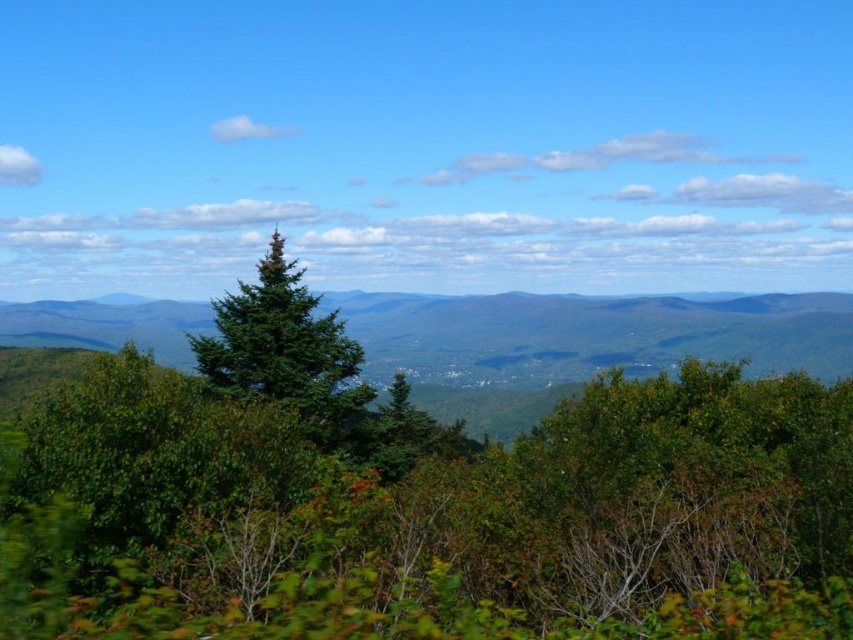
Question: Does green leafy tree at center have a greater width compared to green leafy trees at center?

Choices:
 (A) no
 (B) yes

Answer: (A)

Question: Which point is closer to the camera taking this photo?

Choices:
 (A) (744, 308)
 (B) (283, 280)

Answer: (B)

Question: Does green leafy trees at center appear on the right side of green matte tree at center?

Choices:
 (A) yes
 (B) no

Answer: (B)

Question: Based on their relative distances, which object is farther from the green leafy trees at center?

Choices:
 (A) green leafy tree at center
 (B) green matte tree at center

Answer: (B)

Question: Is green leafy tree at center positioned at the back of green matte tree at center?

Choices:
 (A) no
 (B) yes

Answer: (A)

Question: Which point is closer to the camera taking this photo?

Choices:
 (A) 62,452
 (B) 351,392

Answer: (A)